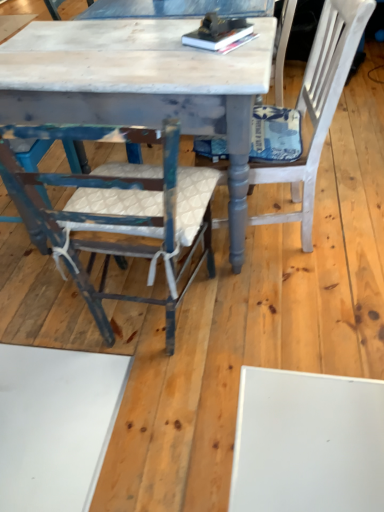
The image size is (384, 512). What do you see at coordinates (219, 33) in the screenshot? I see `hardcover books at center` at bounding box center [219, 33].

Locate an element on the screen. distressed white marble table at center is located at coordinates (140, 86).

I want to click on white textured cushion at right, the first chair positioned from the right, so click(x=317, y=106).

Considering the relative positions of distressed white marble table at center and white textured cushion at right, which is the second chair from left to right, in the image provided, is distressed white marble table at center to the left or to the right of white textured cushion at right, which is the second chair from left to right,?

Clearly, distressed white marble table at center is on the left of white textured cushion at right, which is the second chair from left to right, in the image.

Between distressed white marble table at center and white textured cushion at right, the first chair positioned from the right, which one is positioned in front?

Positioned in front is white textured cushion at right, the first chair positioned from the right.

Based on their sizes in the image, would you say distressed white marble table at center is bigger or smaller than white textured cushion at right, the first chair positioned from the right?

In the image, distressed white marble table at center appears to be larger than white textured cushion at right, the first chair positioned from the right.

Which of these two, distressed blue wood chair at left, which is the first chair from left to right, or distressed white marble table at center, is wider?

distressed white marble table at center is wider.

Does distressed blue wood chair at left, which is the first chair from left to right, turn towards distressed white marble table at center?

Yes, distressed blue wood chair at left, which is the first chair from left to right, is aimed at distressed white marble table at center.

Identify the location of table on the left of distressed blue wood chair at left, the second chair viewed from the right. (140, 86).

Can you tell me how much distressed blue wood chair at left, the second chair viewed from the right, and distressed white marble table at center differ in facing direction?

They differ by 89 degrees in their facing directions.

Which is nearer, (x=241, y=72) or (x=205, y=29)?

Point (x=241, y=72)

Can you confirm if distressed white marble table at center is shorter than hardcover books at center?

No, distressed white marble table at center is not shorter than hardcover books at center.

Is distressed white marble table at center bigger than hardcover books at center?

Yes, distressed white marble table at center is bigger than hardcover books at center.

Is distressed white marble table at center situated inside hardcover books at center or outside?

distressed white marble table at center is located beyond the bounds of hardcover books at center.

Consider the image. Is white textured cushion at right, which is the second chair from left to right, positioned with its back to distressed white marble table at center?

Yes, white textured cushion at right, which is the second chair from left to right,'s orientation is away from distressed white marble table at center.

Consider the image. Is white textured cushion at right, which is the second chair from left to right, taller or shorter than distressed white marble table at center?

In the image, white textured cushion at right, which is the second chair from left to right, appears to be taller than distressed white marble table at center.

From the image's perspective, which object appears higher, white textured cushion at right, which is the second chair from left to right, or distressed white marble table at center?

white textured cushion at right, which is the second chair from left to right, appears higher in the image.

Considering the relative sizes of distressed white marble table at center and distressed blue wood chair at left, which is the first chair from left to right, in the image provided, is distressed white marble table at center bigger than distressed blue wood chair at left, which is the first chair from left to right,?

Indeed, distressed white marble table at center has a larger size compared to distressed blue wood chair at left, which is the first chair from left to right.

From a real-world perspective, which object rests below the other?

From a 3D spatial view, distressed white marble table at center is below.

Which object is more forward, distressed white marble table at center or distressed blue wood chair at left, the second chair viewed from the right?

distressed blue wood chair at left, the second chair viewed from the right, is in front.

From the image's perspective, is distressed blue wood chair at left, the second chair viewed from the right, over white textured cushion at right, the first chair positioned from the right?

No, from the image's perspective, distressed blue wood chair at left, the second chair viewed from the right, is not on top of white textured cushion at right, the first chair positioned from the right.

Considering the sizes of objects distressed blue wood chair at left, the second chair viewed from the right, and white textured cushion at right, which is the second chair from left to right, in the image provided, who is thinner, distressed blue wood chair at left, the second chair viewed from the right, or white textured cushion at right, which is the second chair from left to right,?

Thinner between the two is distressed blue wood chair at left, the second chair viewed from the right.

Is distressed blue wood chair at left, which is the first chair from left to right, taller or shorter than white textured cushion at right, the first chair positioned from the right?

In the image, distressed blue wood chair at left, which is the first chair from left to right, appears to be shorter than white textured cushion at right, the first chair positioned from the right.

Does distressed blue wood chair at left, the second chair viewed from the right, come in front of white textured cushion at right, the first chair positioned from the right?

Yes, the depth of distressed blue wood chair at left, the second chair viewed from the right, is less than that of white textured cushion at right, the first chair positioned from the right.

Looking at this image, is white textured cushion at right, which is the second chair from left to right, placed right next to distressed blue wood chair at left, which is the first chair from left to right?

white textured cushion at right, which is the second chair from left to right, and distressed blue wood chair at left, which is the first chair from left to right, are not in contact.

Considering the relative sizes of white textured cushion at right, the first chair positioned from the right, and distressed blue wood chair at left, which is the first chair from left to right, in the image provided, is white textured cushion at right, the first chair positioned from the right, shorter than distressed blue wood chair at left, which is the first chair from left to right,?

Incorrect, the height of white textured cushion at right, the first chair positioned from the right, does not fall short of that of distressed blue wood chair at left, which is the first chair from left to right.

Is white textured cushion at right, which is the second chair from left to right, in front of distressed blue wood chair at left, the second chair viewed from the right?

No, it is behind distressed blue wood chair at left, the second chair viewed from the right.

Is white textured cushion at right, the first chair positioned from the right, outside of distressed blue wood chair at left, the second chair viewed from the right?

Yes, white textured cushion at right, the first chair positioned from the right, is not within distressed blue wood chair at left, the second chair viewed from the right.

You are a GUI agent. You are given a task and a screenshot of the screen. Output one action in this format:
    pyautogui.click(x=<x>, y=<y>)
    Task: Click on the chair above the distressed white marble table at center (from the image's perspective)
    
    Given the screenshot: What is the action you would take?
    pyautogui.click(x=317, y=106)

Locate an element on the screen. The width and height of the screenshot is (384, 512). table that is under the distressed blue wood chair at left, which is the first chair from left to right (from a real-world perspective) is located at coordinates (140, 86).

Based on their spatial positions, is white textured cushion at right, the first chair positioned from the right, or distressed white marble table at center closer to distressed blue wood chair at left, which is the first chair from left to right?

Among the two, distressed white marble table at center is located nearer to distressed blue wood chair at left, which is the first chair from left to right.

Considering their positions, is hardcover books at center positioned further to distressed blue wood chair at left, which is the first chair from left to right, than white textured cushion at right, the first chair positioned from the right?

Based on the image, hardcover books at center appears to be further to distressed blue wood chair at left, which is the first chair from left to right.

Based on their spatial positions, is distressed white marble table at center or distressed blue wood chair at left, the second chair viewed from the right, further from hardcover books at center?

distressed blue wood chair at left, the second chair viewed from the right, is further to hardcover books at center.

Looking at the image, which one is located further to distressed white marble table at center, hardcover books at center or distressed blue wood chair at left, which is the first chair from left to right?

distressed blue wood chair at left, which is the first chair from left to right, is positioned further to the anchor distressed white marble table at center.

Which object lies further to the anchor point distressed blue wood chair at left, which is the first chair from left to right, hardcover books at center or distressed white marble table at center?

hardcover books at center is positioned further to the anchor distressed blue wood chair at left, which is the first chair from left to right.

Looking at the image, which one is located closer to distressed white marble table at center, white textured cushion at right, which is the second chair from left to right, or distressed blue wood chair at left, which is the first chair from left to right?

Based on the image, distressed blue wood chair at left, which is the first chair from left to right, appears to be nearer to distressed white marble table at center.

Looking at the image, which one is located closer to distressed blue wood chair at left, which is the first chair from left to right, distressed white marble table at center or hardcover books at center?

distressed white marble table at center lies closer to distressed blue wood chair at left, which is the first chair from left to right, than the other object.

From the image, which object appears to be farther from white textured cushion at right, the first chair positioned from the right, hardcover books at center or distressed white marble table at center?

Among the two, distressed white marble table at center is located further to white textured cushion at right, the first chair positioned from the right.

This screenshot has width=384, height=512. I want to click on chair between hardcover books at center and distressed blue wood chair at left, which is the first chair from left to right, in the up-down direction, so click(x=317, y=106).

Where is `chair between distressed white marble table at center and white textured cushion at right, which is the second chair from left to right`? Image resolution: width=384 pixels, height=512 pixels. chair between distressed white marble table at center and white textured cushion at right, which is the second chair from left to right is located at coordinates (123, 214).

You are a GUI agent. You are given a task and a screenshot of the screen. Output one action in this format:
    pyautogui.click(x=<x>, y=<y>)
    Task: Click on the table between hardcover books at center and distressed blue wood chair at left, which is the first chair from left to right, vertically
    
    Given the screenshot: What is the action you would take?
    pyautogui.click(x=140, y=86)

The height and width of the screenshot is (512, 384). I want to click on book between distressed white marble table at center and white textured cushion at right, which is the second chair from left to right, so click(219, 33).